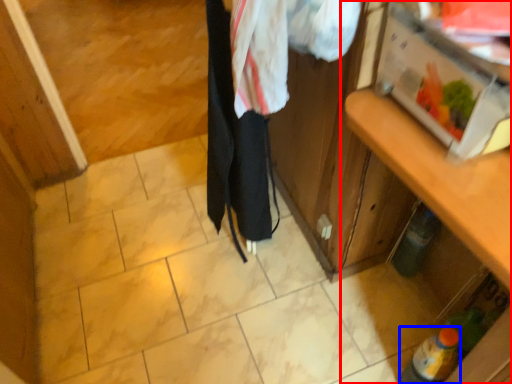
Question: Which of the following is the closest to the observer, cabinetry (highlighted by a red box) or bottle (highlighted by a blue box)?

Choices:
 (A) cabinetry
 (B) bottle

Answer: (A)